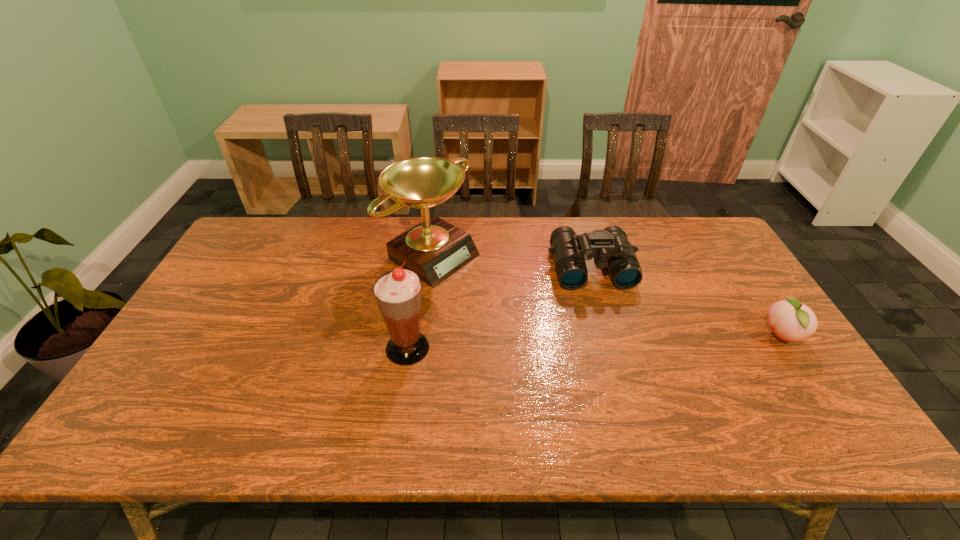
This screenshot has width=960, height=540. Identify the location of free spot on the desktop that is between the smoothie and the peach and is positioned through the lenses of the binoculars. (613, 342).

You are a GUI agent. You are given a task and a screenshot of the screen. Output one action in this format:
    pyautogui.click(x=<x>, y=<y>)
    Task: Click on the free space on the desktop that is between the smoothie and the rightmost object and is positioned on the front-facing side of the award
    Image resolution: width=960 pixels, height=540 pixels.
    Given the screenshot: What is the action you would take?
    pyautogui.click(x=580, y=343)